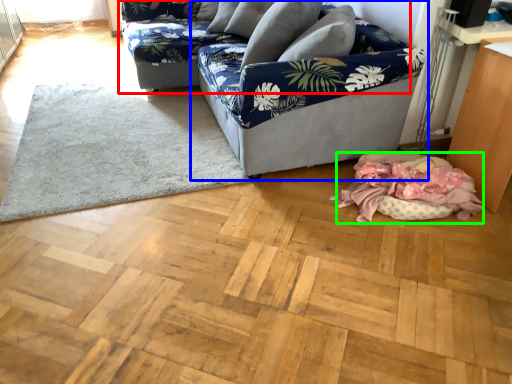
Question: Which is farther away from studio couch (highlighted by a red box)? studio couch (highlighted by a blue box) or blanket (highlighted by a green box)?

Choices:
 (A) studio couch
 (B) blanket

Answer: (B)